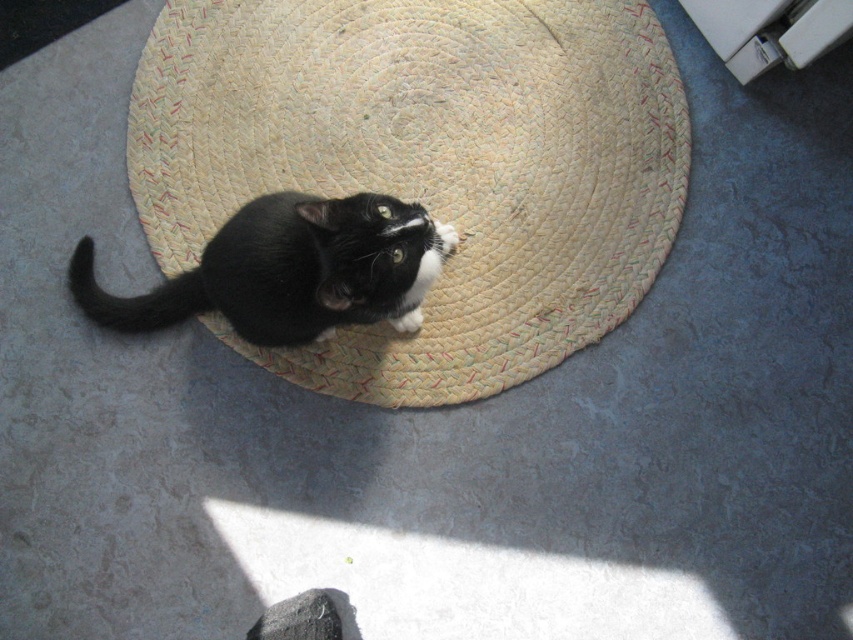
Question: Does natural woven straw hat at center come behind black matte fur cat at center?

Choices:
 (A) no
 (B) yes

Answer: (B)

Question: Can you confirm if natural woven straw hat at center is positioned to the left of black matte fur cat at center?

Choices:
 (A) yes
 (B) no

Answer: (B)

Question: Is natural woven straw hat at center smaller than black matte fur cat at center?

Choices:
 (A) yes
 (B) no

Answer: (B)

Question: Which point is farther from the camera taking this photo?

Choices:
 (A) (325, 289)
 (B) (502, 365)

Answer: (B)

Question: Which of the following is the farthest from the observer?

Choices:
 (A) black matte fur cat at center
 (B) natural woven straw hat at center

Answer: (B)